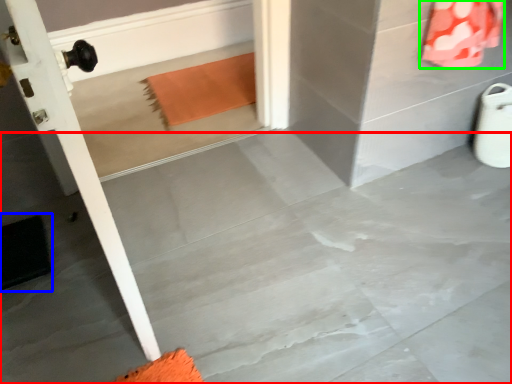
Question: Based on their relative distances, which object is farther from concrete (highlighted by a red box)? Choose from doormat (highlighted by a blue box) and material (highlighted by a green box).

Choices:
 (A) doormat
 (B) material

Answer: (B)